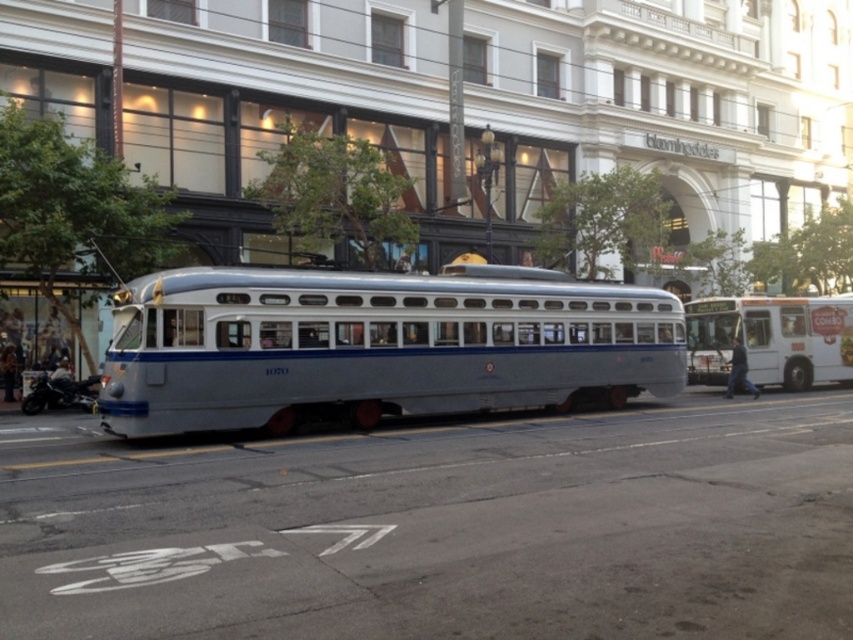
Question: Among these objects, which one is nearest to the camera?

Choices:
 (A) silver polished tram at center
 (B) white matte bus at right

Answer: (A)

Question: Can you confirm if silver polished tram at center is positioned below white matte bus at right?

Choices:
 (A) no
 (B) yes

Answer: (A)

Question: Does silver polished tram at center appear on the left side of white matte bus at right?

Choices:
 (A) no
 (B) yes

Answer: (B)

Question: Is silver polished tram at center thinner than white matte bus at right?

Choices:
 (A) yes
 (B) no

Answer: (B)